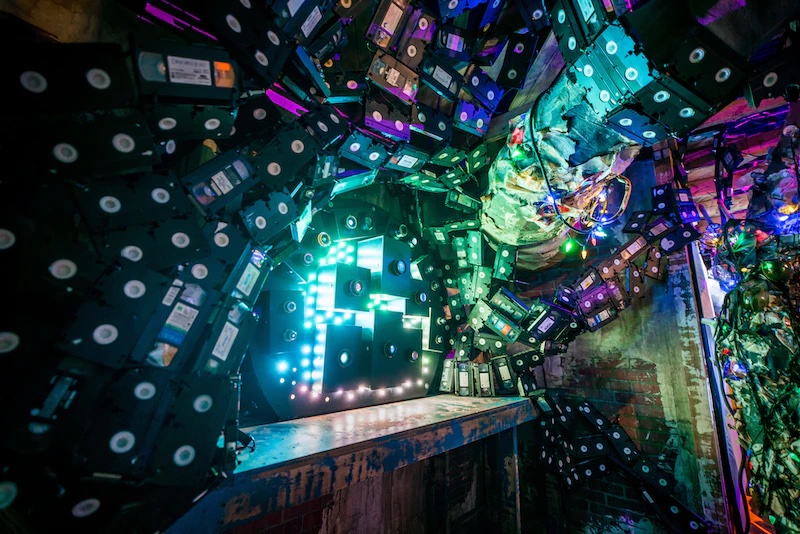
You are a GUI agent. You are given a task and a screenshot of the screen. Output one action in this format:
    pyautogui.click(x=<x>, y=<y>)
    Task: Click on the brick wall
    This screenshot has width=800, height=534.
    Given the screenshot: What is the action you would take?
    pyautogui.click(x=636, y=388)